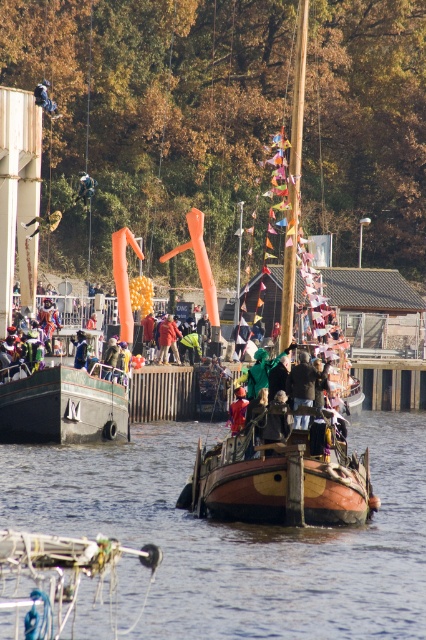
Does point (236, 388) lie behind point (115, 356)?

No, it is in front of (115, 356).

What do you see at coordinates (238, 410) in the screenshot? I see `orange fabric person at center` at bounding box center [238, 410].

Is point (236, 403) more distant than point (112, 362)?

No, it is not.

This screenshot has width=426, height=640. In order to click on orange fabric person at center in this screenshot , I will do `click(238, 410)`.

Which is in front, point (293, 394) or point (236, 401)?

Positioned in front is point (293, 394).

Does dark brown leather jacket at center have a larger size compared to orange fabric person at center?

Actually, dark brown leather jacket at center might be smaller than orange fabric person at center.

Is point (299, 358) positioned in front of point (245, 404)?

Yes, point (299, 358) is in front of point (245, 404).

Find the location of a particular element. dark brown leather jacket at center is located at coordinates (302, 381).

Can you confirm if brown wooden boat at center is positioned to the left of blue fabric person at center?

No, brown wooden boat at center is not to the left of blue fabric person at center.

The height and width of the screenshot is (640, 426). Describe the element at coordinates (238, 536) in the screenshot. I see `brown wooden boat at center` at that location.

Is point (112, 518) positioned before point (85, 182)?

Yes, point (112, 518) is in front of point (85, 182).

Locate an element on the screen. The width and height of the screenshot is (426, 640). brown wooden boat at center is located at coordinates (238, 536).